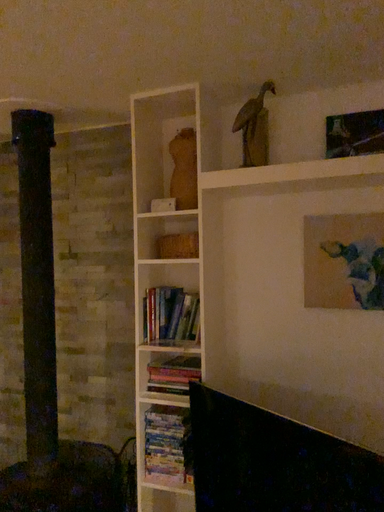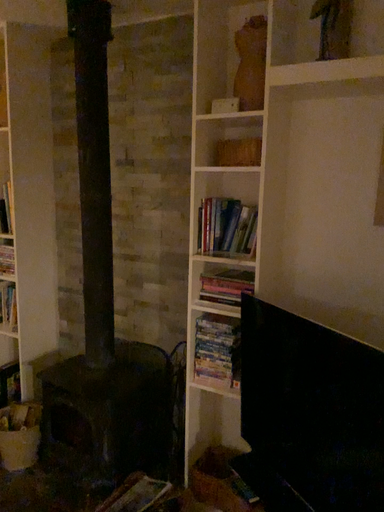
Question: Which way did the camera rotate in the video?

Choices:
 (A) rotated right
 (B) rotated left

Answer: (B)